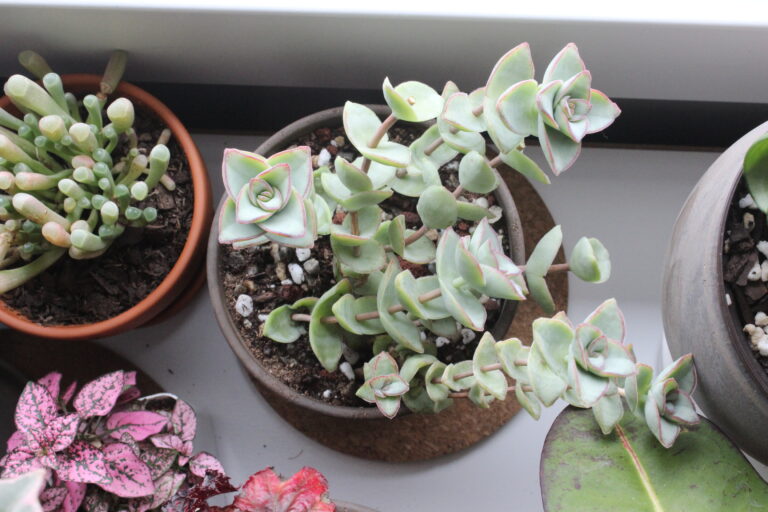
At what (x,y) coordinates should I click in order to perform the action: click on table. Please return your answer as a coordinate pair (x, y). Looking at the image, I should click on coord(214,366).